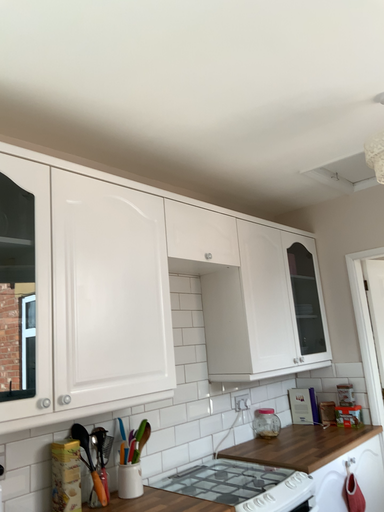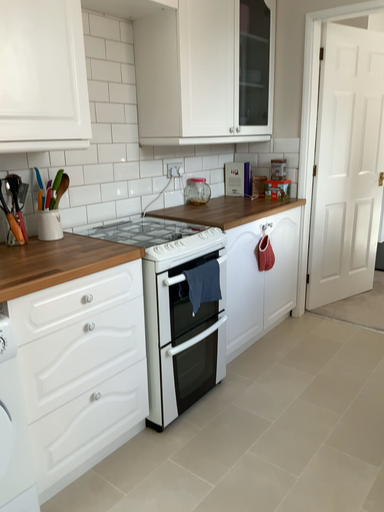
Question: Which way did the camera rotate in the video?

Choices:
 (A) rotated upward
 (B) rotated downward

Answer: (B)